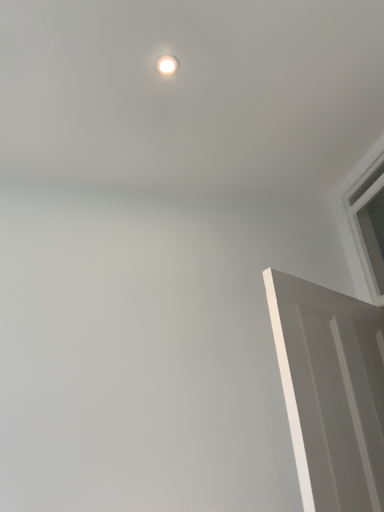
Question: Is white glossy light fixture at upper center bigger than white matte door at right?

Choices:
 (A) yes
 (B) no

Answer: (B)

Question: Considering the relative sizes of white glossy light fixture at upper center and white matte door at right in the image provided, is white glossy light fixture at upper center shorter than white matte door at right?

Choices:
 (A) no
 (B) yes

Answer: (B)

Question: Is white matte door at right inside white glossy light fixture at upper center?

Choices:
 (A) yes
 (B) no

Answer: (B)

Question: From a real-world perspective, is white glossy light fixture at upper center below white matte door at right?

Choices:
 (A) yes
 (B) no

Answer: (B)

Question: Is white glossy light fixture at upper center positioned far away from white matte door at right?

Choices:
 (A) yes
 (B) no

Answer: (A)

Question: Is white plastic window at upper right inside the boundaries of white matte door at right, or outside?

Choices:
 (A) inside
 (B) outside

Answer: (B)

Question: Is point (377, 263) closer or farther from the camera than point (344, 301)?

Choices:
 (A) closer
 (B) farther

Answer: (B)

Question: Is white plastic window at upper right wider or thinner than white matte door at right?

Choices:
 (A) wide
 (B) thin

Answer: (B)

Question: Considering the positions of white plastic window at upper right and white matte door at right in the image, is white plastic window at upper right bigger or smaller than white matte door at right?

Choices:
 (A) small
 (B) big

Answer: (A)

Question: From a real-world perspective, is white glossy light fixture at upper center positioned above or below white matte door at right?

Choices:
 (A) above
 (B) below

Answer: (A)

Question: Would you say white glossy light fixture at upper center is to the left or to the right of white matte door at right in the picture?

Choices:
 (A) left
 (B) right

Answer: (A)

Question: Do you think white glossy light fixture at upper center is within white matte door at right, or outside of it?

Choices:
 (A) inside
 (B) outside

Answer: (B)

Question: In terms of width, does white glossy light fixture at upper center look wider or thinner when compared to white matte door at right?

Choices:
 (A) thin
 (B) wide

Answer: (A)

Question: From a real-world perspective, is white matte door at right above or below white glossy light fixture at upper center?

Choices:
 (A) above
 (B) below

Answer: (B)

Question: Is point (311, 462) closer or farther from the camera than point (167, 62)?

Choices:
 (A) closer
 (B) farther

Answer: (A)